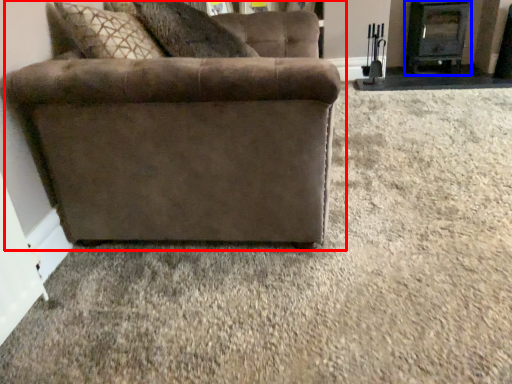
Question: Which of the following is the farthest to the observer, studio couch (highlighted by a red box) or fireplace (highlighted by a blue box)?

Choices:
 (A) studio couch
 (B) fireplace

Answer: (B)